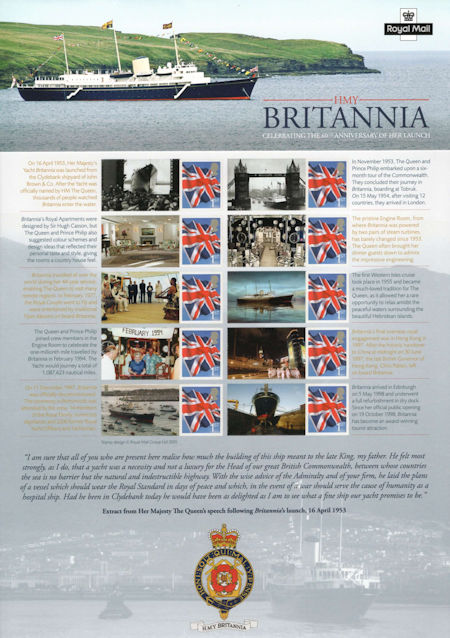
The width and height of the screenshot is (450, 638). Identify the location of piano. (104, 244).